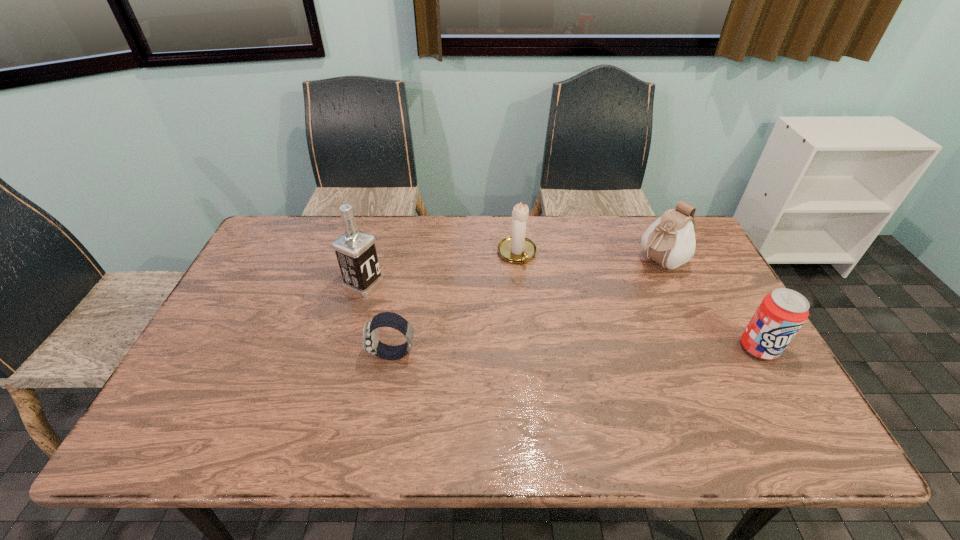
You are a GUI agent. You are given a task and a screenshot of the screen. Output one action in this format:
    pyautogui.click(x=<x>, y=<y>)
    Task: Click on the vacant space located on the surface of the soda can
    The height and width of the screenshot is (540, 960).
    Given the screenshot: What is the action you would take?
    pyautogui.click(x=785, y=394)

Locate an element on the screen. The width and height of the screenshot is (960, 540). free location located on the front-facing side of the pouch is located at coordinates 625,286.

Where is `free spot located 0.090m on the front-facing side of the pouch`? free spot located 0.090m on the front-facing side of the pouch is located at coordinates (625, 286).

Find the location of a particular element. blank space located 0.050m on the front-facing side of the pouch is located at coordinates (633, 280).

What are the coordinates of `free space located 0.250m on the handle side of the candle holder` in the screenshot? It's located at (554, 328).

Identify the location of vacant area located 0.170m on the handle side of the candle holder. This screenshot has height=540, width=960. (543, 307).

The image size is (960, 540). I want to click on vacant space situated on the handle side of the candle holder, so click(575, 370).

Where is `free space located 0.120m on the front label of the vodka`? free space located 0.120m on the front label of the vodka is located at coordinates (412, 305).

The width and height of the screenshot is (960, 540). I want to click on free space located 0.240m on the front label of the vodka, so click(x=447, y=320).

The height and width of the screenshot is (540, 960). I want to click on blank space located 0.170m on the front label of the vodka, so 426,310.